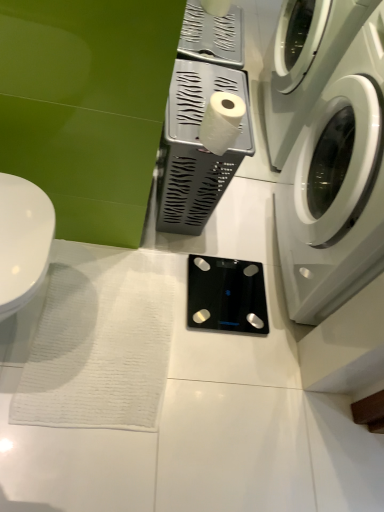
Find the location of `free space above white glossy toilet at left (from a real-world perspective)`. free space above white glossy toilet at left (from a real-world perspective) is located at coordinates (21, 227).